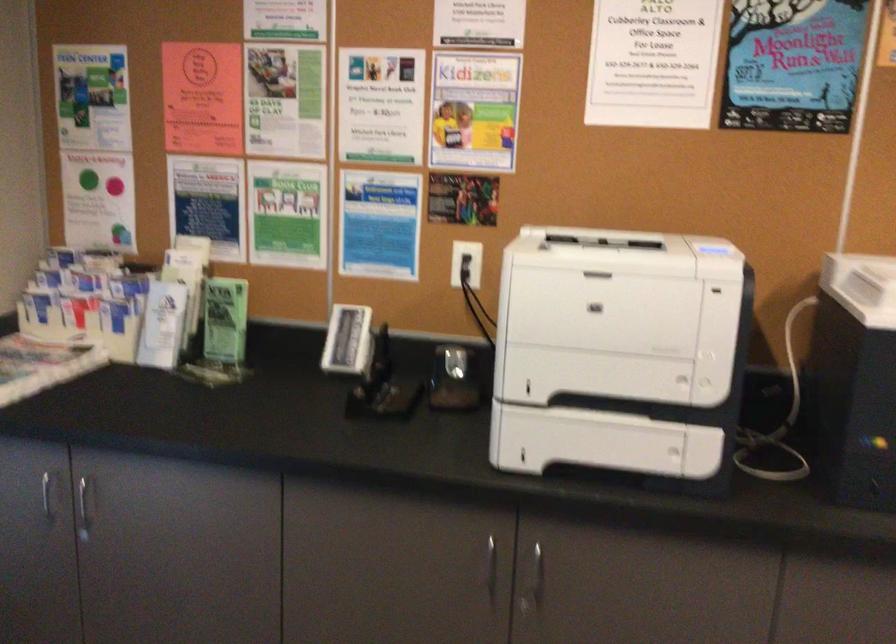
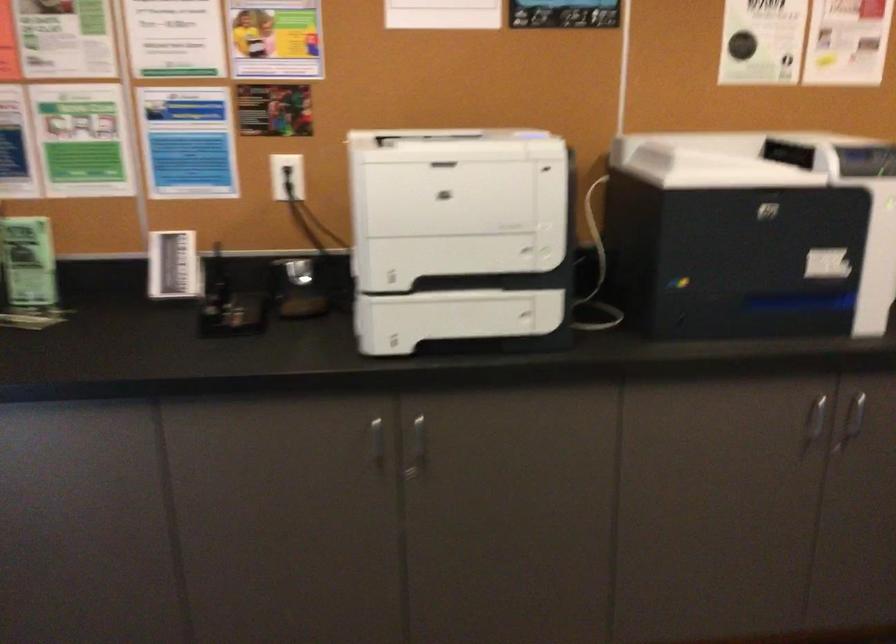
Locate, in the second image, the point that corresponds to pixel 464 266 in the first image.

(287, 176)